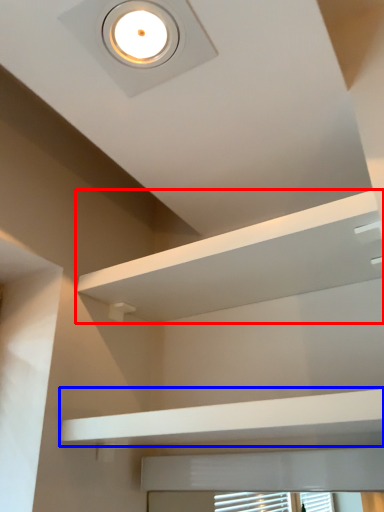
Question: Which object is closer to the camera taking this photo, shelf (highlighted by a red box) or balustrade (highlighted by a blue box)?

Choices:
 (A) shelf
 (B) balustrade

Answer: (B)